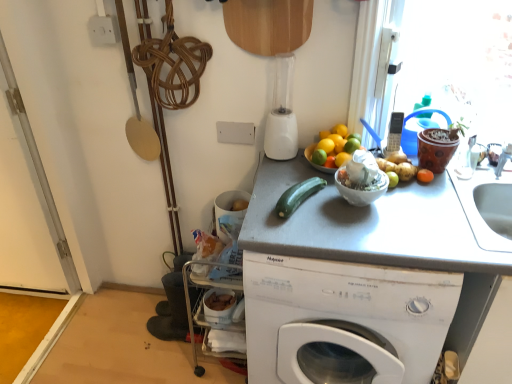
At what (x,y) coordinates should I click in order to perform the action: click on vacant area situated to the left side of orange matte at upper center, which is counted as the 1th orange, starting from the top. Please return your answer as a coordinate pair (x, y). Image resolution: width=512 pixels, height=384 pixels. Looking at the image, I should click on tap(289, 170).